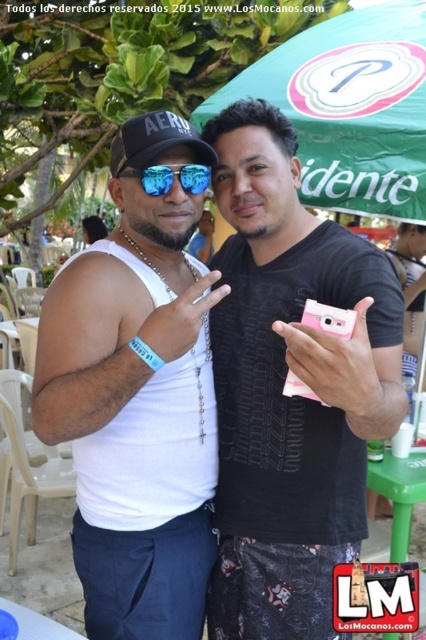
Does green fabric canopy at upper center appear over shiny reflective sunglasses at center?

Yes, green fabric canopy at upper center is above shiny reflective sunglasses at center.

Who is shorter, green fabric canopy at upper center or shiny reflective sunglasses at center?

shiny reflective sunglasses at center is shorter.

Between point (365, 108) and point (163, 188), which one is positioned behind?

The point (365, 108) is more distant.

Locate an element on the screen. green fabric canopy at upper center is located at coordinates (350, 108).

Is green fabric canopy at upper center shorter than black matte baseball cap at upper left?

No.

I want to click on green fabric canopy at upper center, so click(x=350, y=108).

Between black matte baseball cap at upper left and shiny reflective sunglasses at center, which one is positioned lower?

shiny reflective sunglasses at center

Consider the image. Does black matte baseball cap at upper left have a lesser height compared to shiny reflective sunglasses at center?

No.

Who is more forward, [149,148] or [201,179]?

Point [149,148] is more forward.

This screenshot has height=640, width=426. In order to click on black matte baseball cap at upper left in this screenshot , I will do `click(155, 141)`.